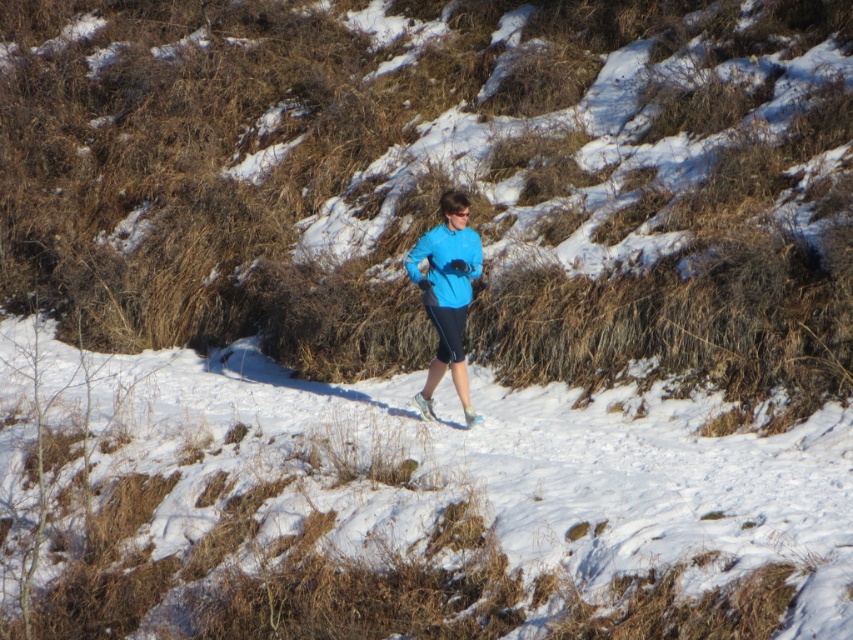
Who is higher up, blue matte jacket at center or blue matte sweatshirt at center?

Positioned higher is blue matte sweatshirt at center.

Does blue matte jacket at center have a lesser width compared to blue matte sweatshirt at center?

Correct, blue matte jacket at center's width is less than blue matte sweatshirt at center's.

Find the location of a particular element. blue matte jacket at center is located at coordinates (447, 296).

Between white powdery snow at center and blue matte sweatshirt at center, which one has less height?

Standing shorter between the two is blue matte sweatshirt at center.

Which is in front, point (527, 454) or point (467, 282)?

Point (527, 454) is in front.

Which is behind, point (138, 540) or point (447, 253)?

The point (447, 253) is more distant.

This screenshot has width=853, height=640. In order to click on white powdery snow at center in this screenshot , I will do `click(397, 508)`.

Who is positioned more to the right, white powdery snow at center or blue matte jacket at center?

blue matte jacket at center is more to the right.

Describe the element at coordinates (397, 508) in the screenshot. Image resolution: width=853 pixels, height=640 pixels. I see `white powdery snow at center` at that location.

Between point (67, 515) and point (442, 324), which one is positioned in front?

Point (67, 515)

Find the location of a particular element. white powdery snow at center is located at coordinates (397, 508).